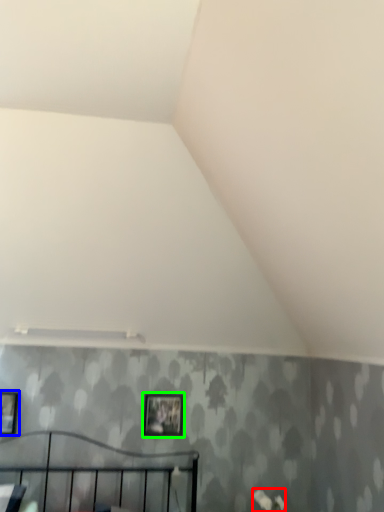
Question: Estimate the real-world distances between objects in this image. Which object is closer to flower (highlighted by a red box), picture frame (highlighted by a blue box) or picture frame (highlighted by a green box)?

Choices:
 (A) picture frame
 (B) picture frame

Answer: (B)